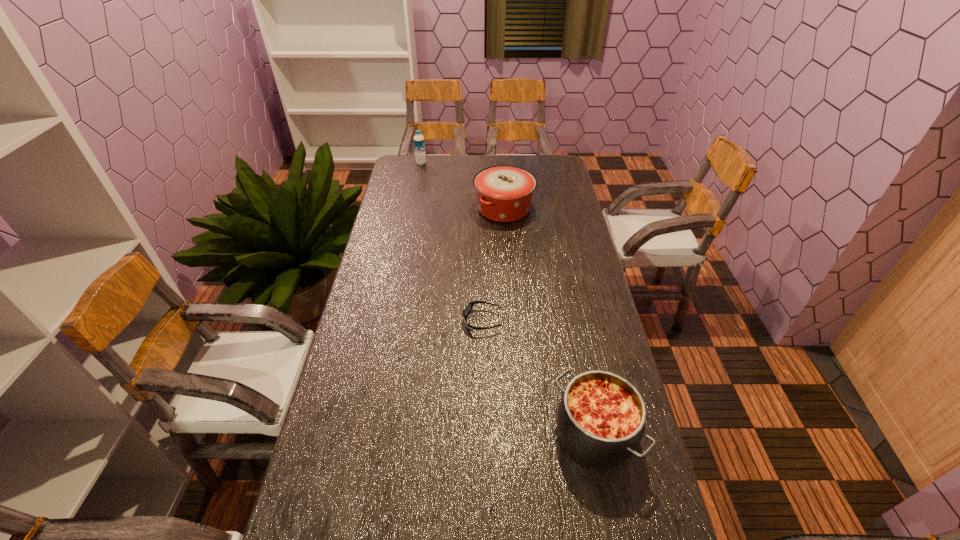
You are a GUI agent. You are given a task and a screenshot of the screen. Output one action in this format:
    pyautogui.click(x=<x>, y=<y>)
    Task: Click on the free point between the shorter casserole and the farther casserole
    The image size is (960, 540).
    Given the screenshot: What is the action you would take?
    pyautogui.click(x=549, y=321)

You are a GUI agent. You are given a task and a screenshot of the screen. Output one action in this format:
    pyautogui.click(x=<x>, y=<y>)
    Task: Click on the vacant area between the water bottle and the shorter casserole
    
    Given the screenshot: What is the action you would take?
    click(508, 299)

Image resolution: width=960 pixels, height=540 pixels. In order to click on free space between the sunglasses and the second farthest object in this screenshot , I will do `click(493, 265)`.

You are a GUI agent. You are given a task and a screenshot of the screen. Output one action in this format:
    pyautogui.click(x=<x>, y=<y>)
    Task: Click on the vacant area that lies between the shortest object and the nearer casserole
    
    Given the screenshot: What is the action you would take?
    pyautogui.click(x=539, y=377)

Where is `free area in between the water bottle and the nearer casserole`? This screenshot has width=960, height=540. free area in between the water bottle and the nearer casserole is located at coordinates (508, 299).

I want to click on vacant space that's between the nearest object and the second nearest object, so click(x=539, y=377).

You are a GUI agent. You are given a task and a screenshot of the screen. Output one action in this format:
    pyautogui.click(x=<x>, y=<y>)
    Task: Click on the free space between the nearest object and the leftmost object
    This screenshot has height=540, width=960.
    Given the screenshot: What is the action you would take?
    pyautogui.click(x=508, y=299)

I want to click on free space between the farther casserole and the second nearest object, so click(x=493, y=265).

Identify the location of vacant area that lies between the nearest object and the farthest object. (508, 299).

I want to click on unoccupied area between the shorter casserole and the water bottle, so click(508, 299).